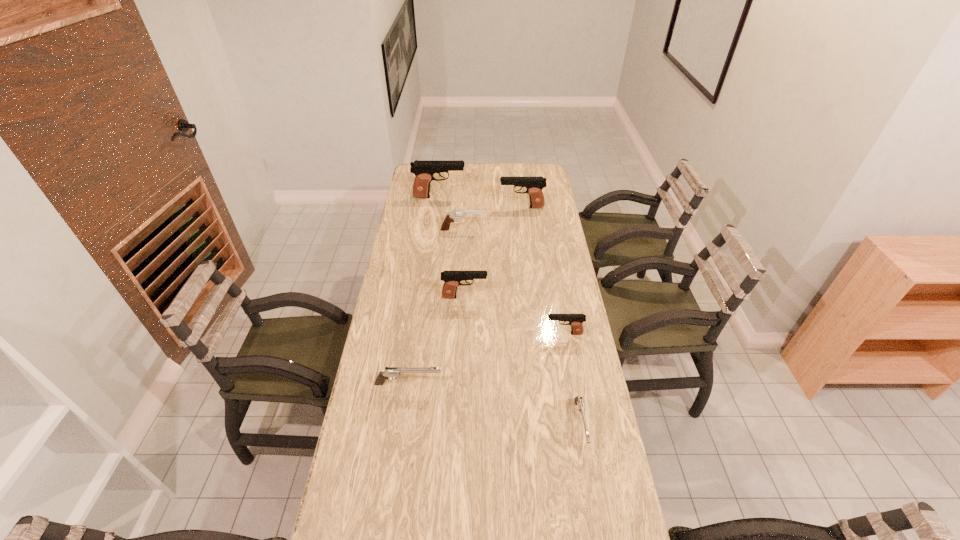
Point out which silver pistol is positioned as the second nearest to the sixth shortest object. Please provide its 2D coordinates. Your answer should be formatted as a tuple, i.e. [(x, y)], where the tuple contains the x and y coordinates of a point satisfying the conditions above.

[(579, 402)]

Locate which silver pistol is the closest to the fifth shortest pistol. Please provide its 2D coordinates. Your answer should be formatted as a tuple, i.e. [(x, y)], where the tuple contains the x and y coordinates of a point satisfying the conditions above.

[(389, 372)]